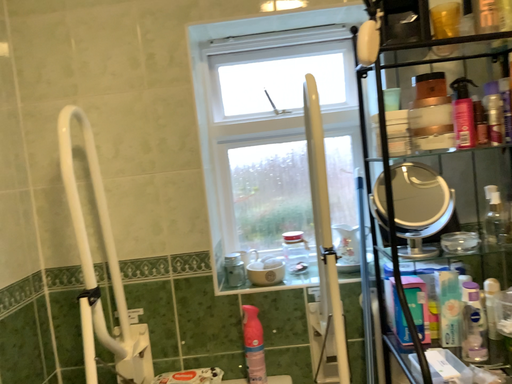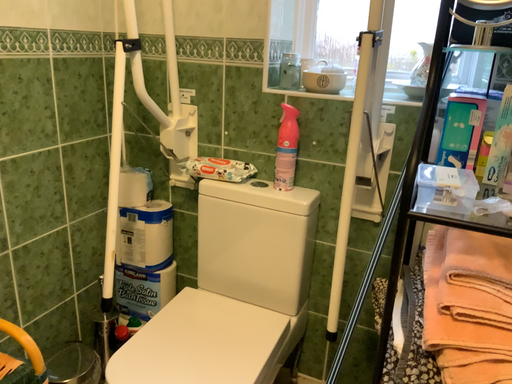
Question: How did the camera likely rotate when shooting the video?

Choices:
 (A) rotated upward
 (B) rotated downward

Answer: (B)